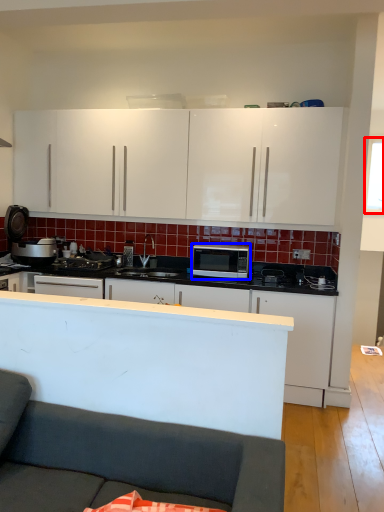
Question: Which point is further to the camera, window screen (highlighted by a red box) or microwave oven (highlighted by a blue box)?

Choices:
 (A) window screen
 (B) microwave oven

Answer: (A)